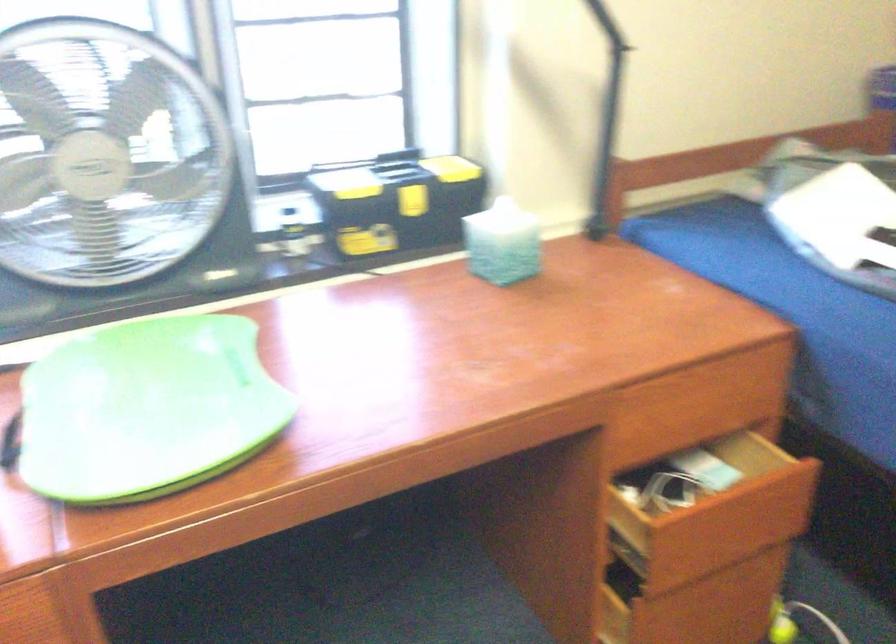
At what (x,y) coordinates should I click in order to perform the action: click on blue tissue box. Please return your answer as a coordinate pair (x, y). Looking at the image, I should click on (503, 243).